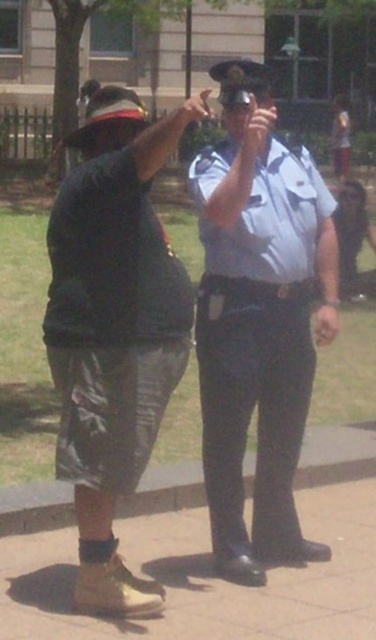
Question: Considering the relative positions of white uniform shirt at center and matte black uniform at center in the image provided, where is white uniform shirt at center located with respect to matte black uniform at center?

Choices:
 (A) right
 (B) left

Answer: (B)

Question: Among these objects, which one is nearest to the camera?

Choices:
 (A) matte black uniform at center
 (B) white uniform shirt at center

Answer: (B)

Question: Which of the following is the farthest from the observer?

Choices:
 (A) white uniform shirt at center
 (B) matte black shirt at center

Answer: (A)

Question: Estimate the real-world distances between objects in this image. Which object is farther from the matte black shirt at center?

Choices:
 (A) matte black uniform at center
 (B) white uniform shirt at center

Answer: (A)

Question: Is white uniform shirt at center positioned before matte black uniform at center?

Choices:
 (A) no
 (B) yes

Answer: (B)

Question: Is white uniform shirt at center to the right of brown leather shoe at lower left from the viewer's perspective?

Choices:
 (A) no
 (B) yes

Answer: (B)